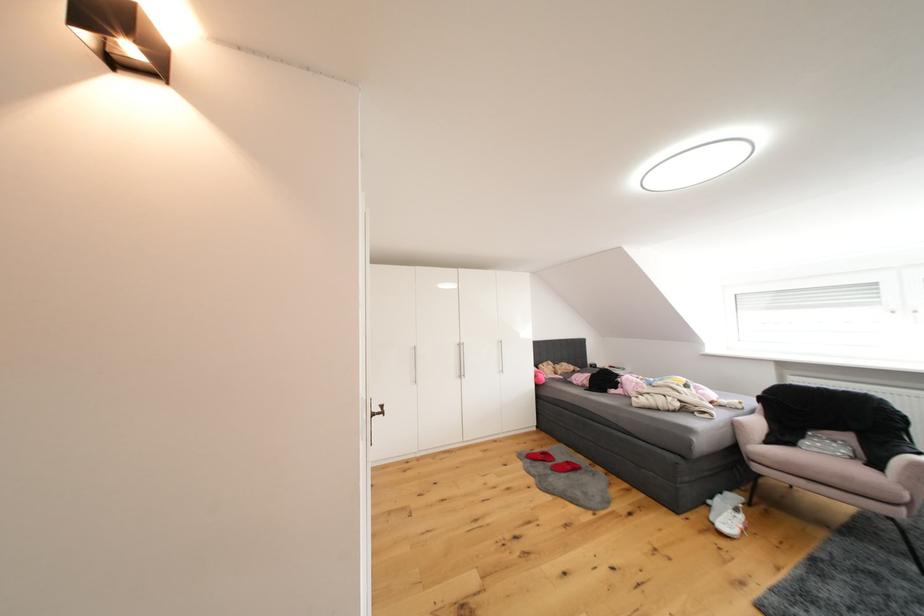
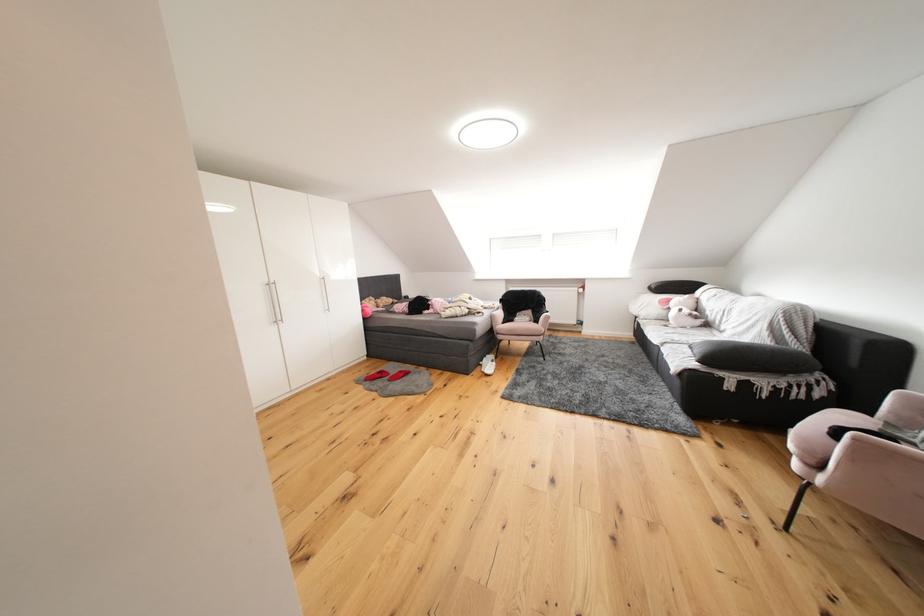
Find the pixel in the second image that matches point 569,456 in the first image.

(402, 371)